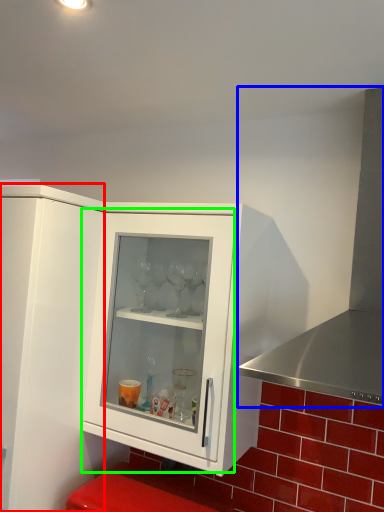
Question: Which is nearer to the cupboard (highlighted by a red box)? exhaust hood (highlighted by a blue box) or glass door (highlighted by a green box).

Choices:
 (A) exhaust hood
 (B) glass door

Answer: (B)